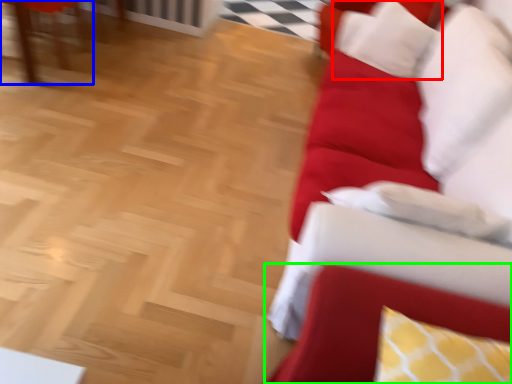
Question: Which object is positioned closest to pillow (highlighted by a red box)? Select from furniture (highlighted by a blue box) and swivel chair (highlighted by a green box).

Choices:
 (A) furniture
 (B) swivel chair

Answer: (B)